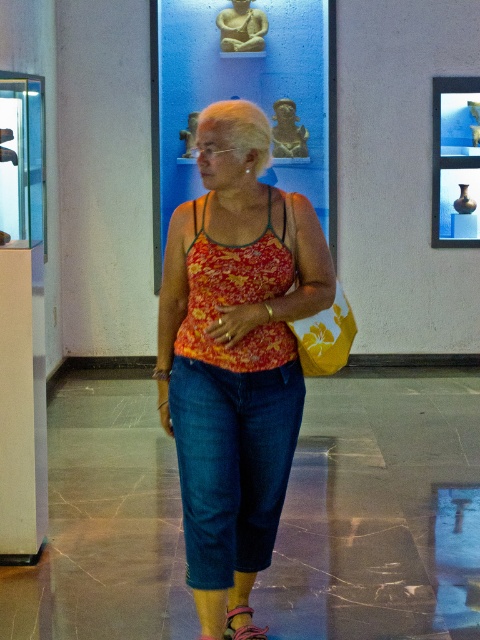
Can you confirm if floral fabric tank top at center is positioned above leather sandal at lower center?

Correct, floral fabric tank top at center is located above leather sandal at lower center.

Between floral fabric tank top at center and leather sandal at lower center, which one is positioned higher?

floral fabric tank top at center is above.

Locate an element on the screen. Image resolution: width=480 pixels, height=640 pixels. floral fabric tank top at center is located at coordinates (233, 355).